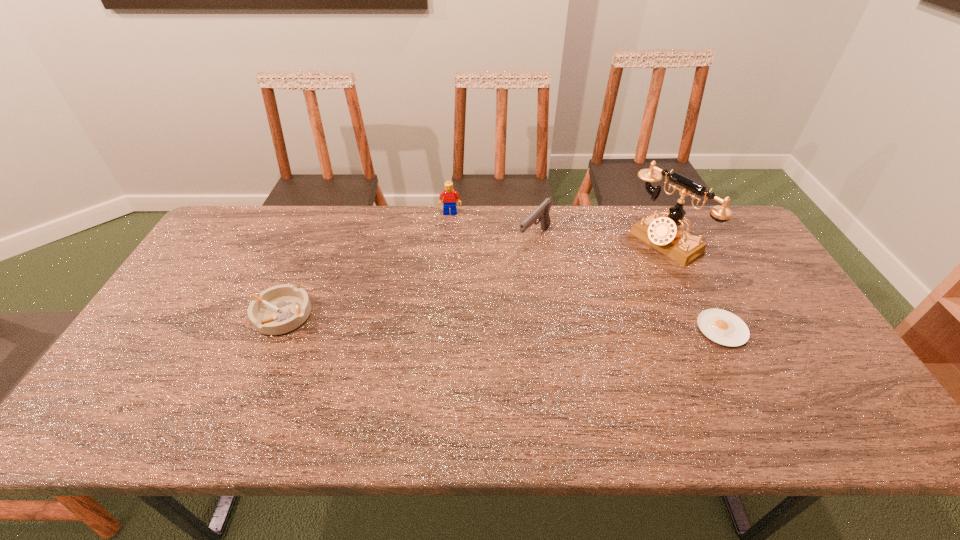
Locate an element on the screen. free space that satisfies the following two spatial constraints: 1. on the front side of the ashtray; 2. on the left side of the shortest object is located at coordinates (276, 329).